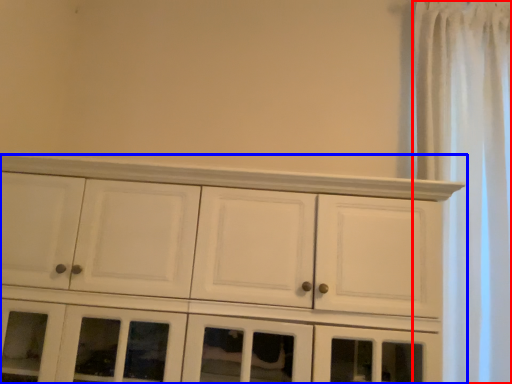
Question: Which point is further to the camera, shower curtain (highlighted by a red box) or cupboard (highlighted by a blue box)?

Choices:
 (A) shower curtain
 (B) cupboard

Answer: (A)